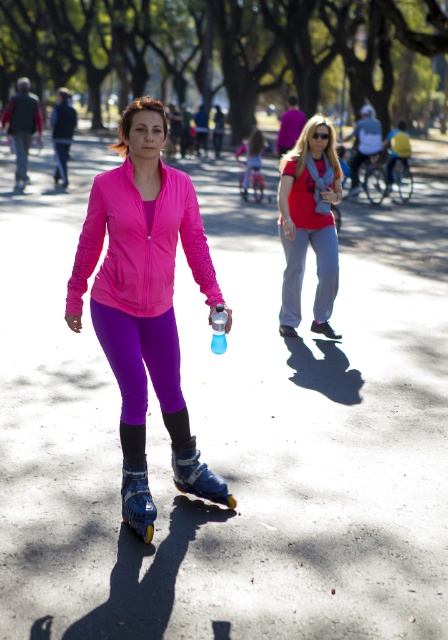
Question: Is pink matte jacket at center behind purple leggings at center?

Choices:
 (A) yes
 (B) no

Answer: (B)

Question: Estimate the real-world distances between objects in this image. Which object is farther from the purple matte leggings at center?

Choices:
 (A) blue plastic roller skate at lower center
 (B) purple leggings at center
 (C) pink zip-up jacket at center
 (D) pink matte jacket at center

Answer: (B)

Question: Which of these objects is positioned closest to the pink zip-up jacket at center?

Choices:
 (A) purple matte leggings at center
 (B) blue plastic roller skate at lower center
 (C) purple leggings at center
 (D) matte red t-shirt at center

Answer: (A)

Question: Does pink matte jacket at center appear under matte red t-shirt at center?

Choices:
 (A) no
 (B) yes

Answer: (B)

Question: Does pink matte jacket at center appear on the left side of pink zip-up jacket at center?

Choices:
 (A) yes
 (B) no

Answer: (A)

Question: Which object is the closest to the purple leggings at center?

Choices:
 (A) pink matte jacket at center
 (B) pink zip-up jacket at center
 (C) matte red t-shirt at center

Answer: (C)